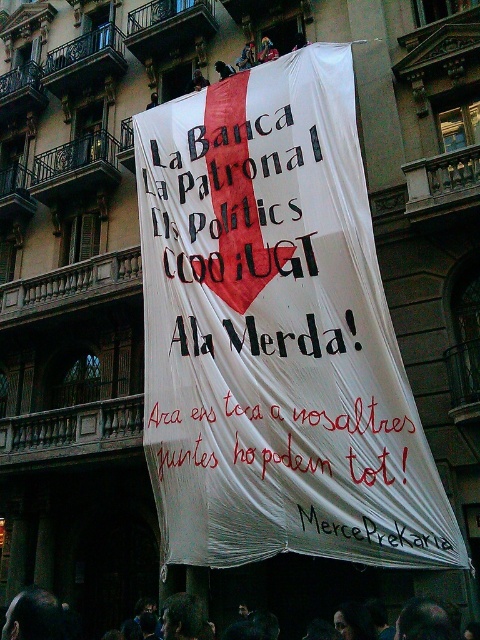
Question: Is white fabric banner at center thinner than red fabric banner at center?

Choices:
 (A) yes
 (B) no

Answer: (B)

Question: Does white fabric banner at center appear under black paper at center?

Choices:
 (A) yes
 (B) no

Answer: (B)

Question: From the image, what is the correct spatial relationship of white fabric banner at center in relation to black paper at center?

Choices:
 (A) left
 (B) right

Answer: (A)

Question: Among these points, which one is nearest to the camera?

Choices:
 (A) (384, 544)
 (B) (303, 467)
 (C) (357, 177)

Answer: (A)

Question: Among these points, which one is nearest to the camera?

Choices:
 (A) (243, 531)
 (B) (296, 468)

Answer: (B)

Question: Estimate the real-world distances between objects in this image. Which object is closer to the black paper at center?

Choices:
 (A) white fabric banner at center
 (B) red fabric banner at center
 (C) dark hair at lower center

Answer: (B)